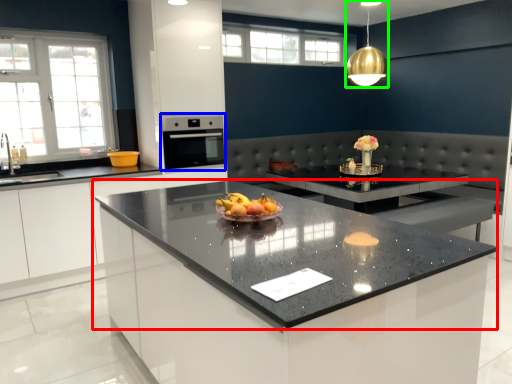
Question: Which object is positioned closest to countertop (highlighted by a red box)? Select from oven (highlighted by a blue box) and light fixture (highlighted by a green box).

Choices:
 (A) oven
 (B) light fixture

Answer: (A)